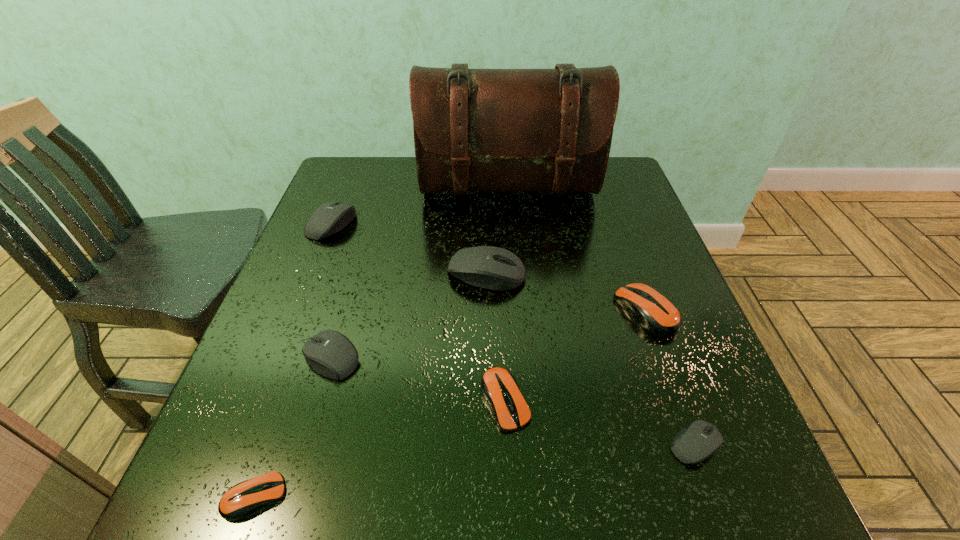
I want to click on vacant space situated 0.050m on the left of the second smallest orange computer mouse, so click(x=451, y=401).

At what (x,y) coordinates should I click in order to perform the action: click on vacant point located 0.150m on the left of the smallest black computer equipment. Please return your answer as a coordinate pair (x, y). Looking at the image, I should click on (576, 444).

The height and width of the screenshot is (540, 960). I want to click on free space located 0.390m on the back of the smallest orange computer mouse, so click(x=326, y=292).

Find the location of `object at the far edge`. object at the far edge is located at coordinates (496, 130).

You are a GUI agent. You are given a task and a screenshot of the screen. Output one action in this format:
    pyautogui.click(x=<x>, y=<y>)
    Task: Click on the satchel at the right edge
    
    Given the screenshot: What is the action you would take?
    pyautogui.click(x=496, y=130)

Identify the location of object that is positioned at the near left corner. (244, 498).

Identify the location of object located in the far right corner section of the desktop. This screenshot has height=540, width=960. (496, 130).

Locate an element on the screen. The width and height of the screenshot is (960, 540). object that is positioned at the near right corner is located at coordinates (700, 440).

Image resolution: width=960 pixels, height=540 pixels. In the image, there is a desktop. Identify the location of blank space at the near edge. (390, 477).

At what (x,y) coordinates should I click in order to perform the action: click on vacant region at the left edge of the desktop. Please return your answer as a coordinate pair (x, y). The height and width of the screenshot is (540, 960). Looking at the image, I should click on (343, 264).